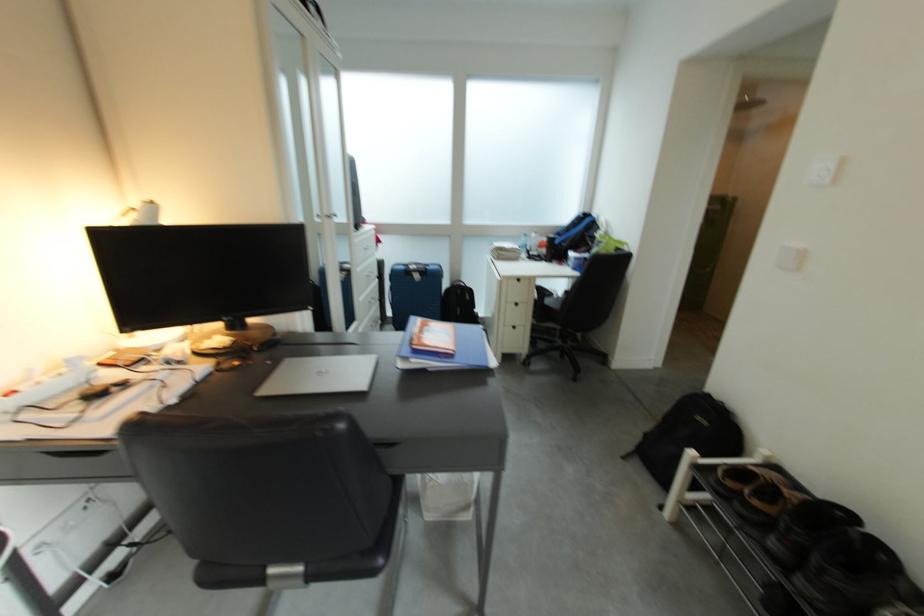
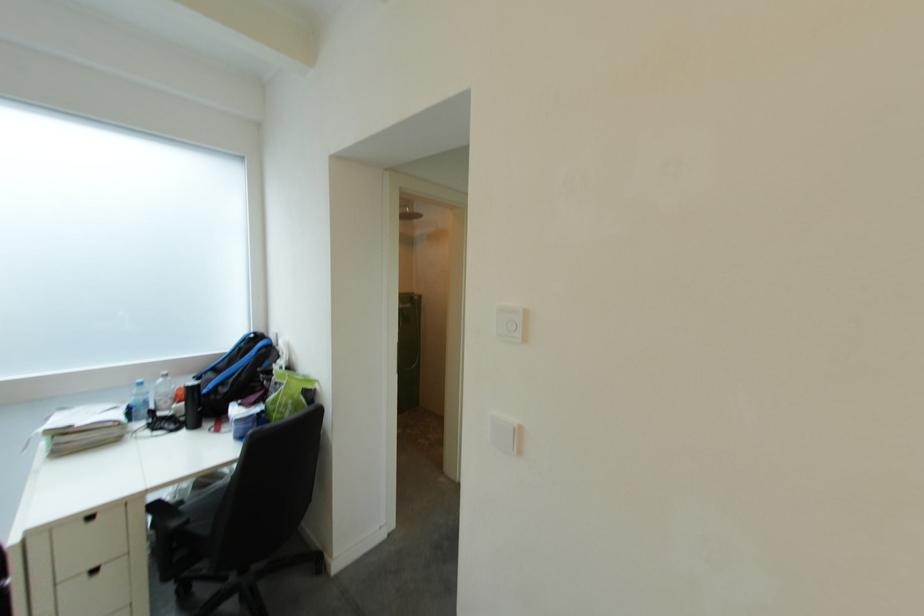
In the second image, find the point that corresponds to [540,252] in the first image.

(163, 410)